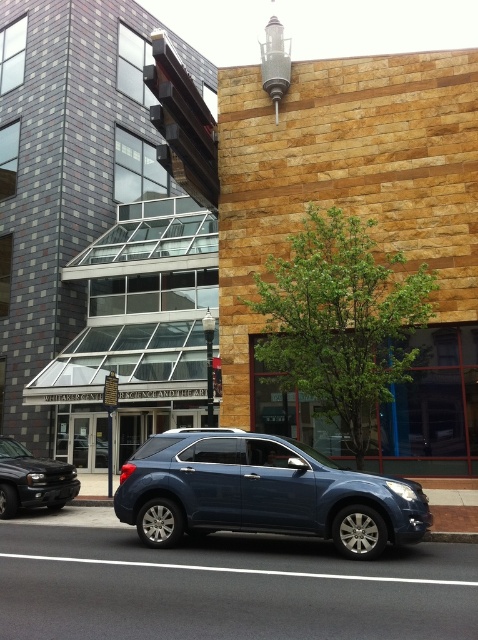
You are a delivery person trying to park a 6.5 feet tall delivery van. You see the satin blue suv at center and the shiny black suv at lower left. Which SUV can you safely park next to without hitting the van?

The shiny black suv at lower left is shorter than the satin blue suv at center. Since the delivery van is 6.5 feet tall, parking next to the shiny black suv at lower left would be safer to avoid hitting the van.

You are a delivery person trying to park a shiny black suv at lower left and a matte black suv at center in a garage with a height restriction of 6 feet. Which SUV should you park first if you need to ensure both can fit?

The shiny black suv at lower left has a lesser height compared to the matte black suv at center. Therefore, you should park the matte black suv at center first to ensure it meets the height restriction, as the shiny black suv at lower left is shorter and more likely to fit under 6 feet.